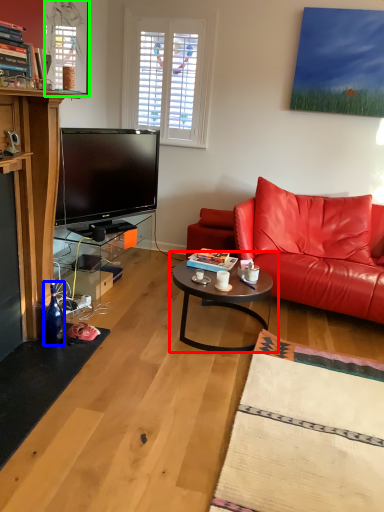
Question: Which is nearer to the coffee table (highlighted by a red box)? bottle (highlighted by a blue box) or window screen (highlighted by a green box).

Choices:
 (A) bottle
 (B) window screen

Answer: (A)